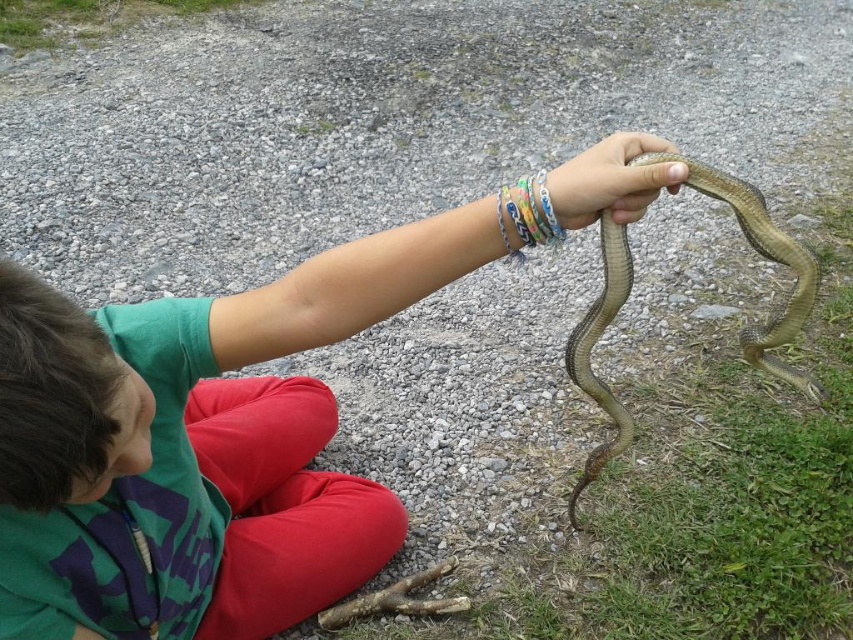
Question: Is green matte shirt at upper center wider than multicolored plastic bracelets at center?

Choices:
 (A) yes
 (B) no

Answer: (A)

Question: Which point is closer to the camera taking this photo?

Choices:
 (A) tap(583, 349)
 (B) tap(519, 196)
 (C) tap(195, 605)
 (D) tap(641, 211)

Answer: (B)

Question: Among these objects, which one is nearest to the camera?

Choices:
 (A) green matte shirt at upper center
 (B) smooth skin hand at center
 (C) green scaly snake at right
 (D) multicolored plastic bracelets at center

Answer: (A)

Question: Which of the following is the farthest from the observer?

Choices:
 (A) smooth skin hand at center
 (B) multicolored plastic bracelets at center
 (C) green matte shirt at upper center

Answer: (B)

Question: Is green scaly snake at right to the right of smooth skin hand at center from the viewer's perspective?

Choices:
 (A) no
 (B) yes

Answer: (B)

Question: In this image, where is green scaly snake at right located relative to multicolored plastic bracelets at center?

Choices:
 (A) right
 (B) left

Answer: (A)